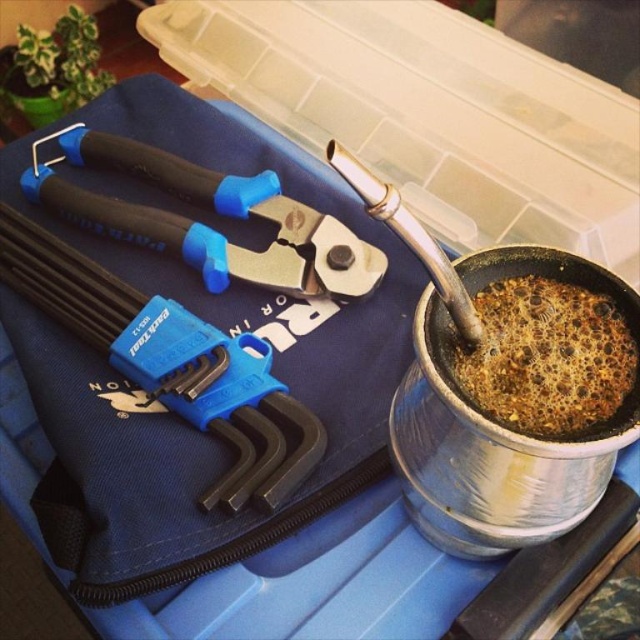
Based on the photo, who is positioned more to the right, blue plastic hex key set at upper left or black plastic pliers at upper left?

From the viewer's perspective, black plastic pliers at upper left appears more on the right side.

Image resolution: width=640 pixels, height=640 pixels. What do you see at coordinates (172, 362) in the screenshot? I see `blue plastic hex key set at upper left` at bounding box center [172, 362].

Identify the location of blue plastic hex key set at upper left. (172, 362).

Does black plastic pliers at upper left have a greater height compared to brown matte coffee at right?

Correct, black plastic pliers at upper left is much taller as brown matte coffee at right.

Based on the photo, is black plastic pliers at upper left shorter than brown matte coffee at right?

No, black plastic pliers at upper left is not shorter than brown matte coffee at right.

Describe the element at coordinates (208, 227) in the screenshot. This screenshot has width=640, height=640. I see `black plastic pliers at upper left` at that location.

Where is `black plastic pliers at upper left`? This screenshot has width=640, height=640. black plastic pliers at upper left is located at coordinates (208, 227).

Is blue plastic hex key set at upper left taller than brown matte coffee at right?

Indeed, blue plastic hex key set at upper left has a greater height compared to brown matte coffee at right.

Can you confirm if blue plastic hex key set at upper left is positioned to the left of brown matte coffee at right?

Indeed, blue plastic hex key set at upper left is positioned on the left side of brown matte coffee at right.

The height and width of the screenshot is (640, 640). Find the location of `blue plastic hex key set at upper left`. blue plastic hex key set at upper left is located at coordinates (172, 362).